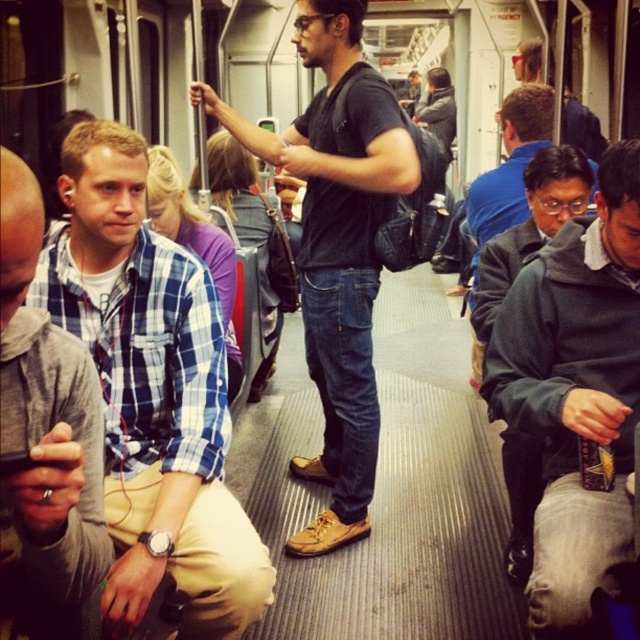
Identify the location of blue plaid shirt at center. Image resolution: width=640 pixels, height=640 pixels. (152, 394).

Is blue plaid shirt at center below dark green sweater at right?

No, blue plaid shirt at center is not below dark green sweater at right.

Locate an element on the screen. The width and height of the screenshot is (640, 640). blue plaid shirt at center is located at coordinates (152, 394).

The width and height of the screenshot is (640, 640). Identify the location of blue plaid shirt at center. (152, 394).

Does blue plaid shirt at center have a lesser height compared to matte black backpack at center?

Incorrect, blue plaid shirt at center's height does not fall short of matte black backpack at center's.

Between blue plaid shirt at center and matte black backpack at center, which one is positioned higher?

Positioned higher is matte black backpack at center.

Between point (148, 474) and point (512, 61), which one is positioned behind?

The point (512, 61) is behind.

At what (x,y) coordinates should I click in order to perform the action: click on blue plaid shirt at center. Please return your answer as a coordinate pair (x, y). The image size is (640, 640). Looking at the image, I should click on (152, 394).

Which is behind, point (579, 420) or point (540, 61)?

Positioned behind is point (540, 61).

Measure the distance between dark green sweater at right and camera.

The distance of dark green sweater at right from camera is 2.01 meters.

The height and width of the screenshot is (640, 640). What are the coordinates of `dark green sweater at right` in the screenshot? It's located at point(577,394).

The height and width of the screenshot is (640, 640). In order to click on dark green sweater at right in this screenshot , I will do `click(577, 394)`.